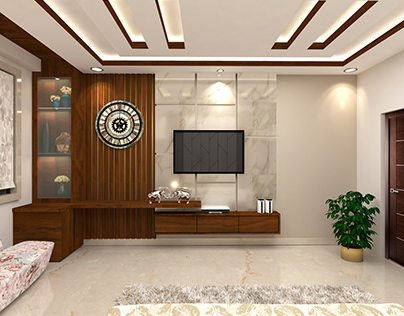
Image resolution: width=404 pixels, height=316 pixels. What are the coordinates of `floating shelf unit` in the screenshot? It's located at (232, 215).